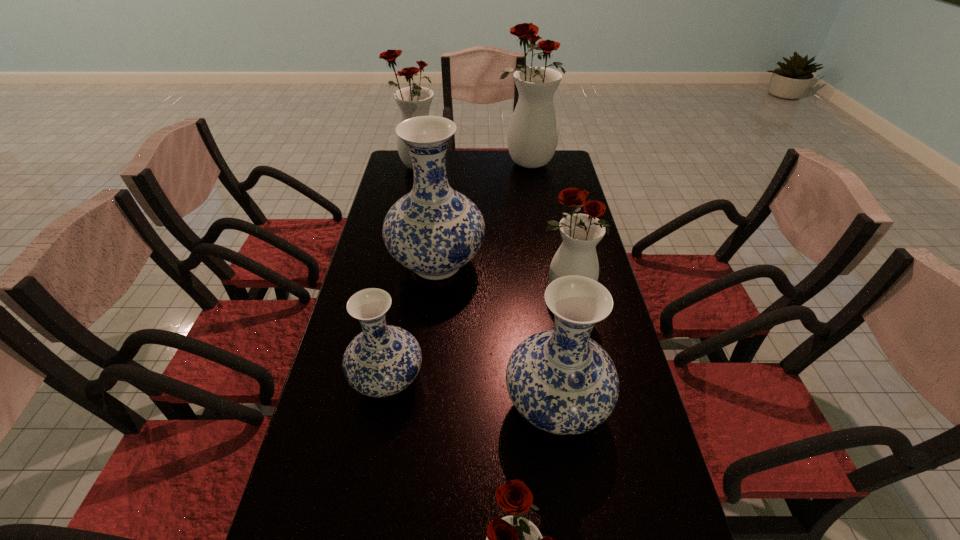
Locate an element on the screen. The height and width of the screenshot is (540, 960). empty space between the farthest blue vase and the tallest vase is located at coordinates (482, 214).

The width and height of the screenshot is (960, 540). Find the location of `free space between the second smallest blue vase and the third smallest red vase`. free space between the second smallest blue vase and the third smallest red vase is located at coordinates (487, 287).

Point out which object is positioned as the nearest to the smallest blue vase. Please provide its 2D coordinates. Your answer should be formatted as a tuple, i.e. [(x, y)], where the tuple contains the x and y coordinates of a point satisfying the conditions above.

[(433, 230)]

Locate which object ranks fifth in proximity to the third farthest red vase. Please provide its 2D coordinates. Your answer should be formatted as a tuple, i.e. [(x, y)], where the tuple contains the x and y coordinates of a point satisfying the conditions above.

[(532, 137)]

Select which vase appears as the sixth closest to the tallest object. Please provide its 2D coordinates. Your answer should be formatted as a tuple, i.e. [(x, y)], where the tuple contains the x and y coordinates of a point satisfying the conditions above.

[(513, 539)]

Identify the location of vase that is the fifth nearest to the farthest blue vase. (532, 137).

Find the location of `the closest red vase to the farthest blue vase`. the closest red vase to the farthest blue vase is located at coordinates (577, 255).

Identify which red vase is the third closest to the biggest blue vase. Please provide its 2D coordinates. Your answer should be formatted as a tuple, i.e. [(x, y)], where the tuple contains the x and y coordinates of a point satisfying the conditions above.

[(532, 137)]

The image size is (960, 540). I want to click on blue vase identified as the closest to the smallest red vase, so click(x=560, y=380).

What are the coordinates of `blue vase that is the nearest to the nearest vase` in the screenshot? It's located at [560, 380].